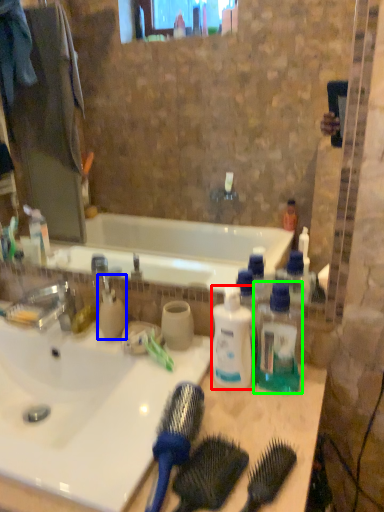
Question: Based on their relative distances, which object is farther from bottle (highlighted by a red box)? Choose from cleaning product (highlighted by a blue box) and bottle (highlighted by a green box).

Choices:
 (A) cleaning product
 (B) bottle

Answer: (A)